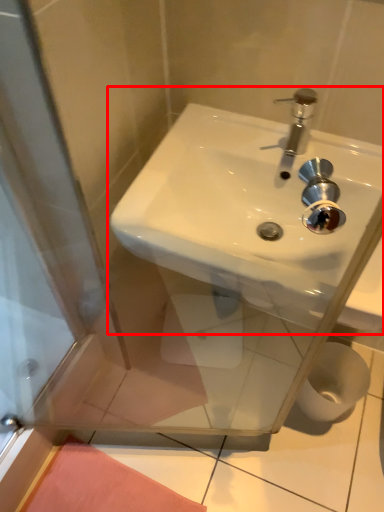
Question: Where is sink (annotated by the red box) located in relation to toilet paper in the image?

Choices:
 (A) right
 (B) left

Answer: (B)